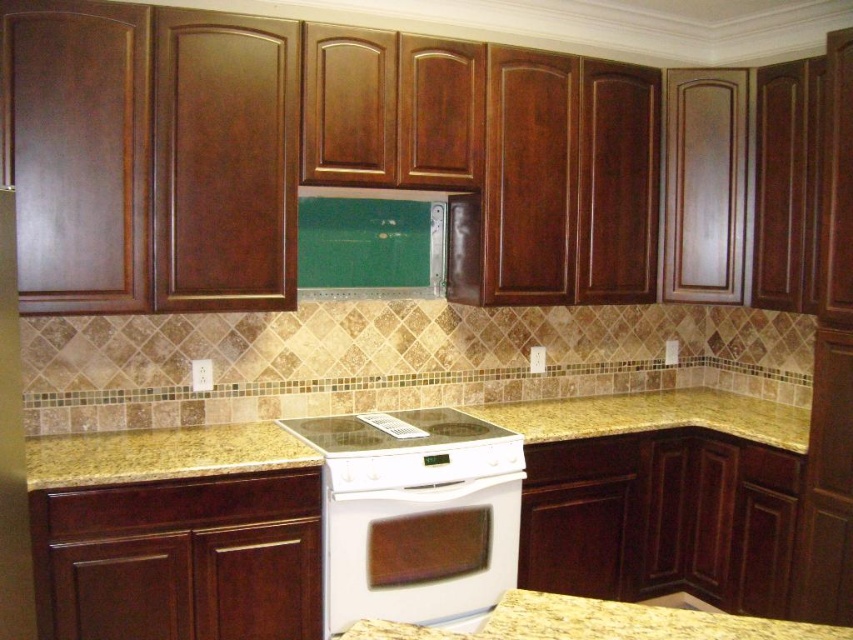
Question: Considering the relative positions of white glossy stove at center and yellow granite countertop at lower center in the image provided, where is white glossy stove at center located with respect to yellow granite countertop at lower center?

Choices:
 (A) right
 (B) left

Answer: (B)

Question: Can you confirm if yellow granite countertop at center is smaller than white glossy stove at center?

Choices:
 (A) yes
 (B) no

Answer: (B)

Question: Which point is closer to the camera?

Choices:
 (A) white glossy oven at center
 (B) yellow granite countertop at lower center
 (C) green glass exhaust hood at center

Answer: (B)

Question: Among these points, which one is nearest to the camera?

Choices:
 (A) click(x=492, y=522)
 (B) click(x=56, y=451)

Answer: (B)

Question: Which object is the farthest from the green glass exhaust hood at center?

Choices:
 (A) yellow granite countertop at center
 (B) yellow granite countertop at lower center

Answer: (B)

Question: Does green glass exhaust hood at center have a larger size compared to white glossy stove at center?

Choices:
 (A) yes
 (B) no

Answer: (B)